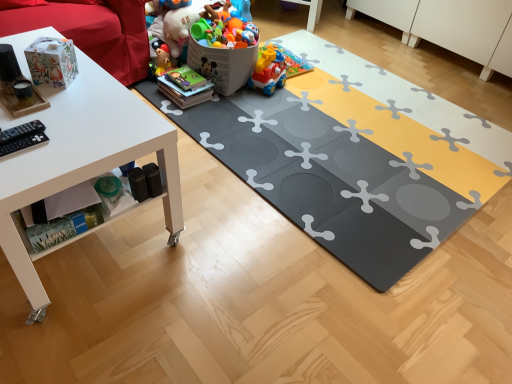
Question: Is the position of plastic toy at center, acting as the second toy starting from the front, less distant than that of white matte table at left?

Choices:
 (A) no
 (B) yes

Answer: (A)

Question: From the image's perspective, does plastic toy at center, the third toy viewed from the back, appear higher than white matte table at left?

Choices:
 (A) no
 (B) yes

Answer: (B)

Question: Does plastic toy at center, the third toy viewed from the back, have a lesser width compared to white matte table at left?

Choices:
 (A) yes
 (B) no

Answer: (A)

Question: Can you confirm if plastic toy at center, the third toy viewed from the back, is positioned to the left of white matte table at left?

Choices:
 (A) yes
 (B) no

Answer: (B)

Question: Considering the relative sizes of plastic toy at center, acting as the second toy starting from the front, and white matte table at left in the image provided, is plastic toy at center, acting as the second toy starting from the front, taller than white matte table at left?

Choices:
 (A) yes
 (B) no

Answer: (B)

Question: Looking at the image, does gray rubber yoga mat at center seem bigger or smaller compared to plastic multicolored toy train at center, the 4th toy in the front-to-back sequence?

Choices:
 (A) small
 (B) big

Answer: (B)

Question: Is gray rubber yoga mat at center taller or shorter than plastic multicolored toy train at center, arranged as the 1th toy when viewed from the back?

Choices:
 (A) short
 (B) tall

Answer: (A)

Question: From the image's perspective, is gray rubber yoga mat at center located above or below plastic multicolored toy train at center, the 4th toy in the front-to-back sequence?

Choices:
 (A) above
 (B) below

Answer: (B)

Question: In the image, is gray rubber yoga mat at center positioned in front of or behind plastic multicolored toy train at center, arranged as the 1th toy when viewed from the back?

Choices:
 (A) front
 (B) behind

Answer: (A)

Question: Visually, is matte paper bag at upper left, placed as the fourth toy when sorted from back to front, positioned to the left or to the right of plastic toy at upper center, the second toy positioned from the back?

Choices:
 (A) right
 (B) left

Answer: (B)

Question: In the image, is matte paper bag at upper left, which appears as the 1th toy when viewed from the front, positioned in front of or behind plastic toy at upper center, the second toy positioned from the back?

Choices:
 (A) behind
 (B) front

Answer: (B)

Question: From the image's perspective, is matte paper bag at upper left, placed as the fourth toy when sorted from back to front, located above or below plastic toy at upper center, the second toy positioned from the back?

Choices:
 (A) below
 (B) above

Answer: (A)

Question: Do you think matte paper bag at upper left, placed as the fourth toy when sorted from back to front, is within plastic toy at upper center, the second toy positioned from the back, or outside of it?

Choices:
 (A) outside
 (B) inside

Answer: (A)

Question: In the image, is plastic multicolored toy train at center, arranged as the 1th toy when viewed from the back, positioned in front of or behind white matte table at left?

Choices:
 (A) front
 (B) behind

Answer: (B)

Question: Choose the correct answer: Is plastic multicolored toy train at center, the 4th toy in the front-to-back sequence, inside white matte table at left or outside it?

Choices:
 (A) outside
 (B) inside

Answer: (A)